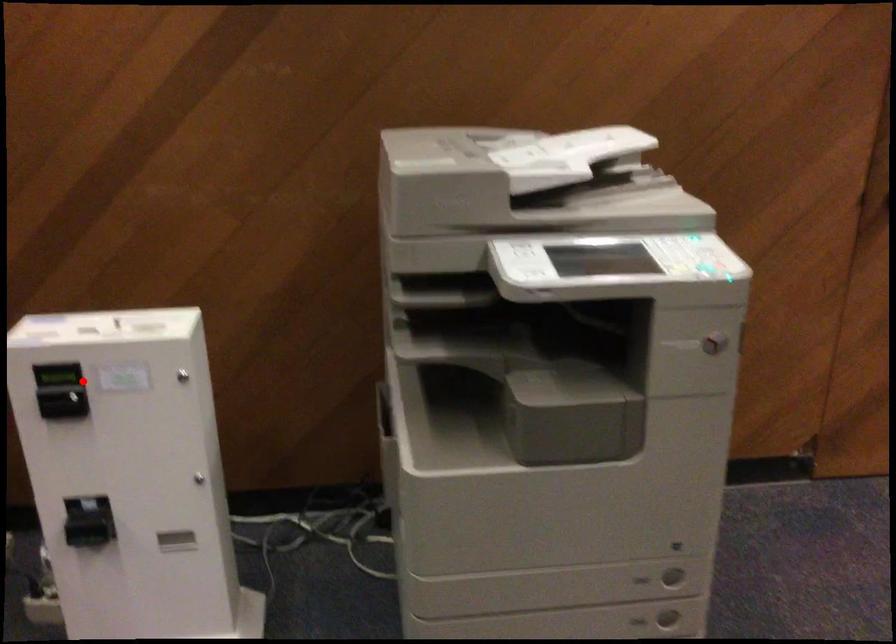
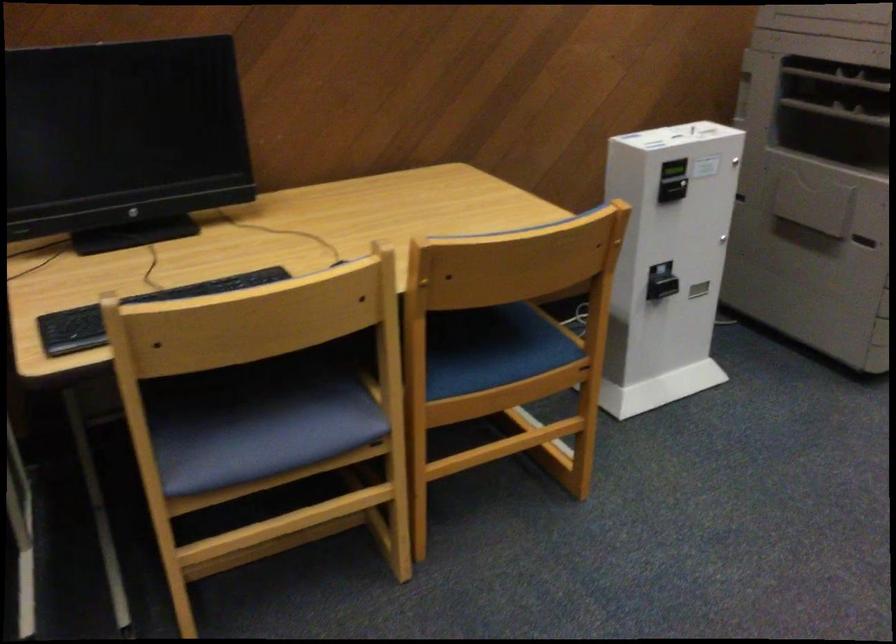
Question: I am providing you with two images of the same scene from different viewpoints. Given a red point in image1, look at the same physical point in image2. Is it:

Choices:
 (A) Closer to the viewpoint
 (B) Farther from the viewpoint

Answer: (B)